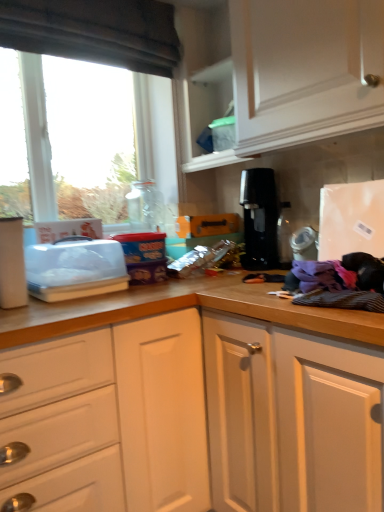
Question: From a real-world perspective, is black plastic coffee machine at center above or below clear plastic container at left?

Choices:
 (A) below
 (B) above

Answer: (B)

Question: Is black plastic coffee machine at center wider or thinner than clear plastic container at left?

Choices:
 (A) thin
 (B) wide

Answer: (A)

Question: Based on their relative distances, which object is farther from the transparent glass window at left?

Choices:
 (A) dark fabric exhaust hood at upper left
 (B) clear plastic container at left
 (C) black plastic coffee machine at center

Answer: (B)

Question: Which is farther from the transparent glass window at left?

Choices:
 (A) clear plastic container at left
 (B) dark fabric exhaust hood at upper left
 (C) black plastic coffee machine at center

Answer: (A)